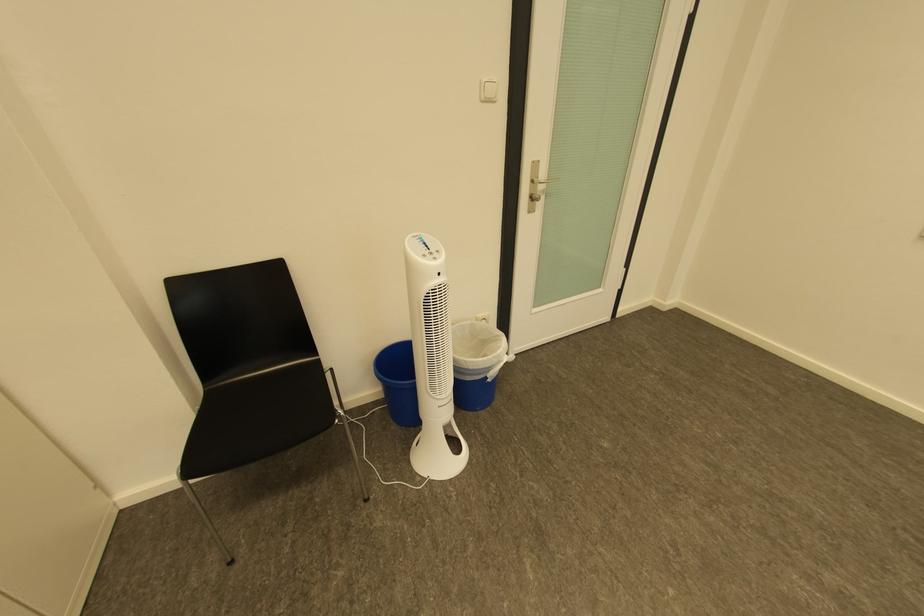
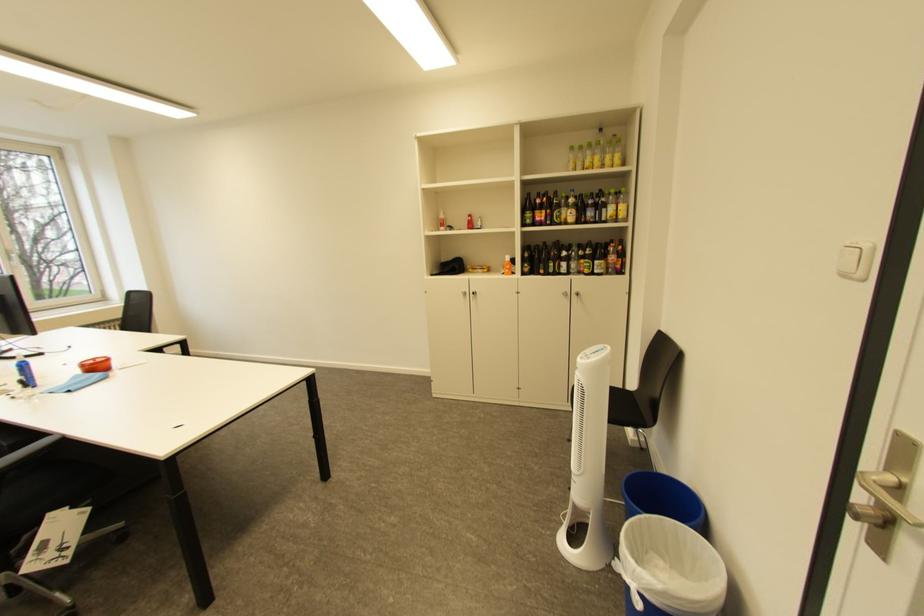
The point at (509, 363) is marked in the first image. Where is the corresponding point in the second image?

(636, 570)